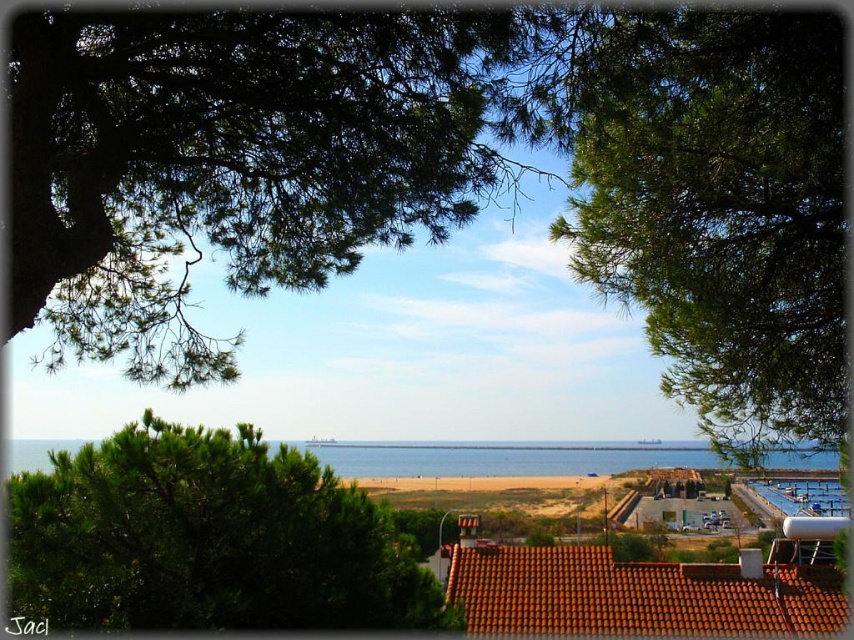
You are standing at the top of a cliff overlooking the beach. You see a point marked at coordinates (244, 156). What is located at this point?

The point at coordinates (244, 156) indicates green needle leaves at upper center.